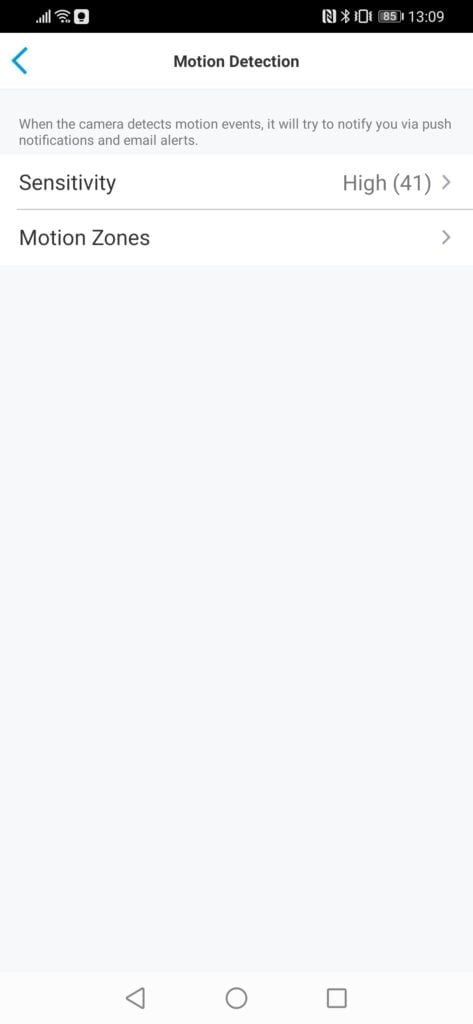
Locate an element on the screen. clock is located at coordinates (429, 15).